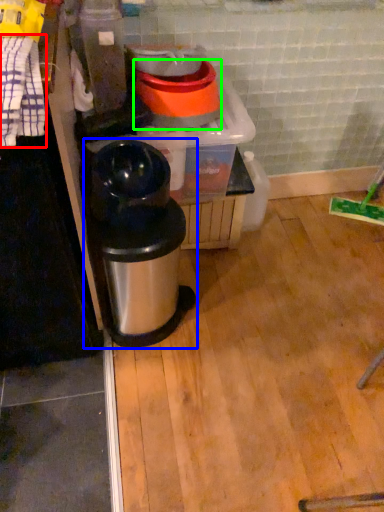
Question: Which is farther away from laundry (highlighted by a red box)? waste container (highlighted by a blue box) or appliance (highlighted by a green box)?

Choices:
 (A) waste container
 (B) appliance

Answer: (B)